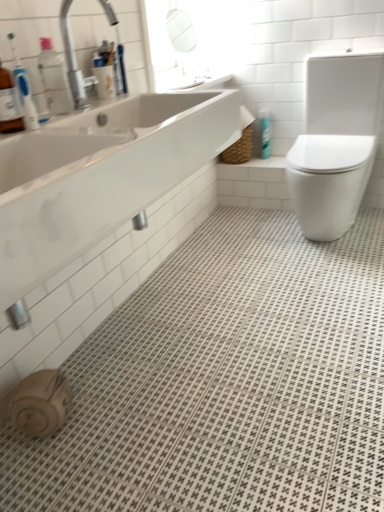
Question: Is silver metallic faucet at upper left taller or shorter than white glossy sink at upper left?

Choices:
 (A) tall
 (B) short

Answer: (B)

Question: Considering their positions, is silver metallic faucet at upper left located in front of or behind white glossy sink at upper left?

Choices:
 (A) behind
 (B) front

Answer: (A)

Question: Based on their relative distances, which object is farther from the white glossy toilet at right?

Choices:
 (A) silver metallic faucet at upper left
 (B) blue glossy spray can at upper right
 (C) white glossy sink at upper left

Answer: (A)

Question: Based on their relative distances, which object is farther from the white glossy toilet at right?

Choices:
 (A) white glossy sink at upper left
 (B) blue glossy spray can at upper right
 (C) silver metallic faucet at upper left

Answer: (C)